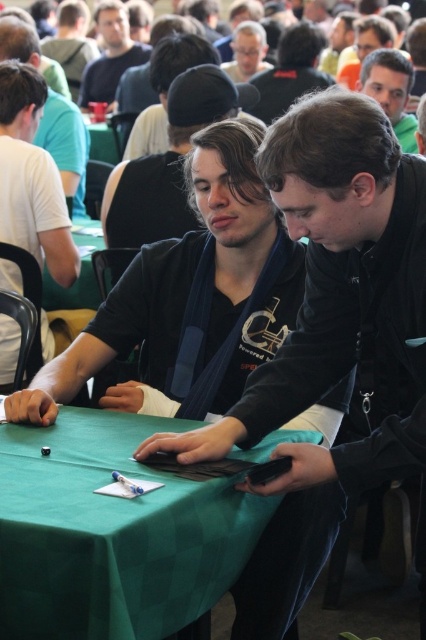
I want to click on matte black laptop at center, so click(333, 340).

Who is more forward, (371, 416) or (173, 582)?

Point (173, 582) is more forward.

Where is `matte black laptop at center`? This screenshot has width=426, height=640. matte black laptop at center is located at coordinates (333, 340).

Can you confirm if green checkered table at center is taller than matte black jacket at upper left?

No.

Where is `green checkered table at center`? The height and width of the screenshot is (640, 426). green checkered table at center is located at coordinates (112, 532).

Is point (112, 545) closer to camera compared to point (127, 52)?

Yes, point (112, 545) is in front of point (127, 52).

Identify the location of green checkered table at center. (112, 532).

Who is more forward, (412, 150) or (253, 36)?

Point (412, 150) is in front.

Consider the image. Does matte black hair at upper right have a lesser height compared to matte black glasses at upper center?

Incorrect, matte black hair at upper right's height does not fall short of matte black glasses at upper center's.

Does point (414, 144) come farther from viewer compared to point (232, 48)?

That is False.

Identify the location of matte black hair at upper right. Image resolution: width=426 pixels, height=640 pixels. (391, 90).